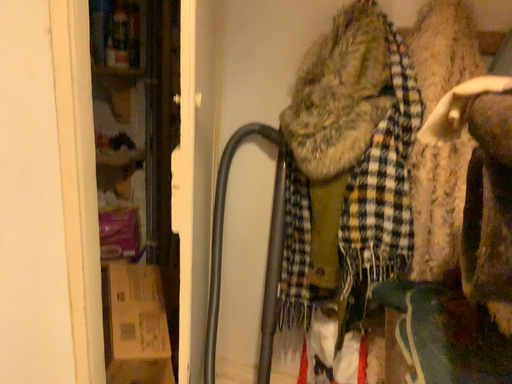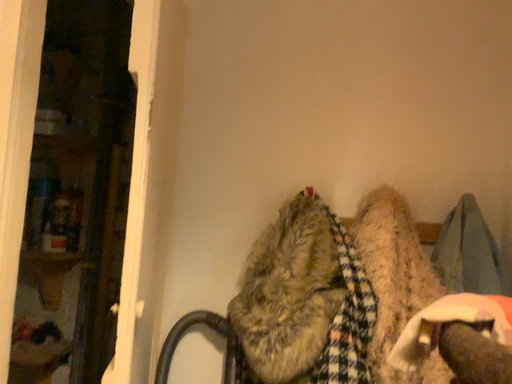
Question: Which way did the camera rotate in the video?

Choices:
 (A) rotated downward
 (B) rotated upward

Answer: (B)